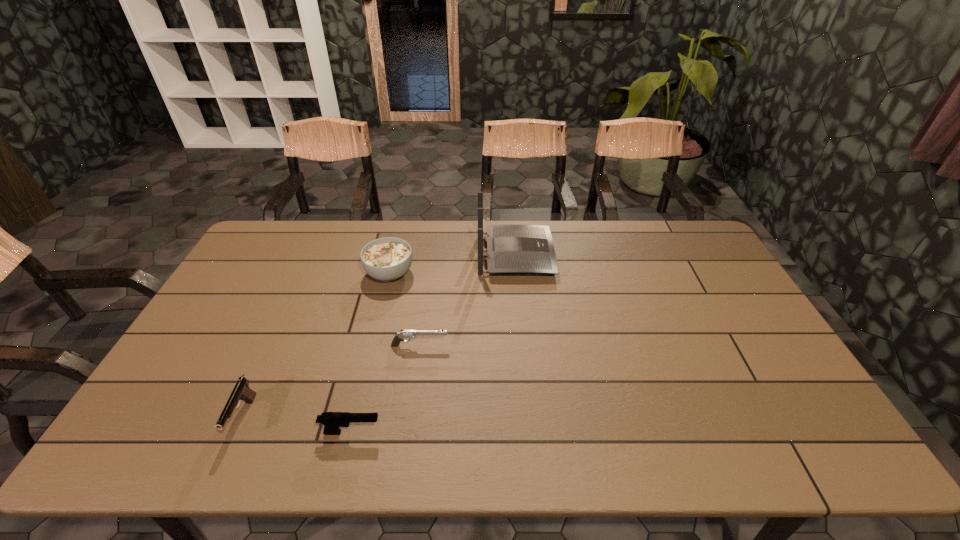
Where is `router`? This screenshot has width=960, height=540. router is located at coordinates (511, 249).

Where is `the tallest object`? The width and height of the screenshot is (960, 540). the tallest object is located at coordinates (511, 249).

Where is `soup bowl`? soup bowl is located at coordinates point(387,259).

This screenshot has width=960, height=540. What are the coordinates of `the leftmost object` in the screenshot? It's located at (241, 391).

What are the coordinates of `the third farthest object` in the screenshot? It's located at (404, 334).

This screenshot has height=540, width=960. Find the location of `the shortest pistol`. the shortest pistol is located at coordinates (404, 334).

In order to click on free region located 0.290m on the front-facing side of the tallest object in this screenshot , I will do `click(636, 255)`.

Locate an element on the screen. free location located 0.210m on the back of the soup bowl is located at coordinates (401, 224).

At what (x,y) coordinates should I click in order to perform the action: click on blank space located on the front-facing side of the third farthest object. Please return your answer as a coordinate pair (x, y). The width and height of the screenshot is (960, 540). Looking at the image, I should click on (523, 346).

What are the coordinates of `router that is positioned at the far edge` in the screenshot? It's located at (511, 249).